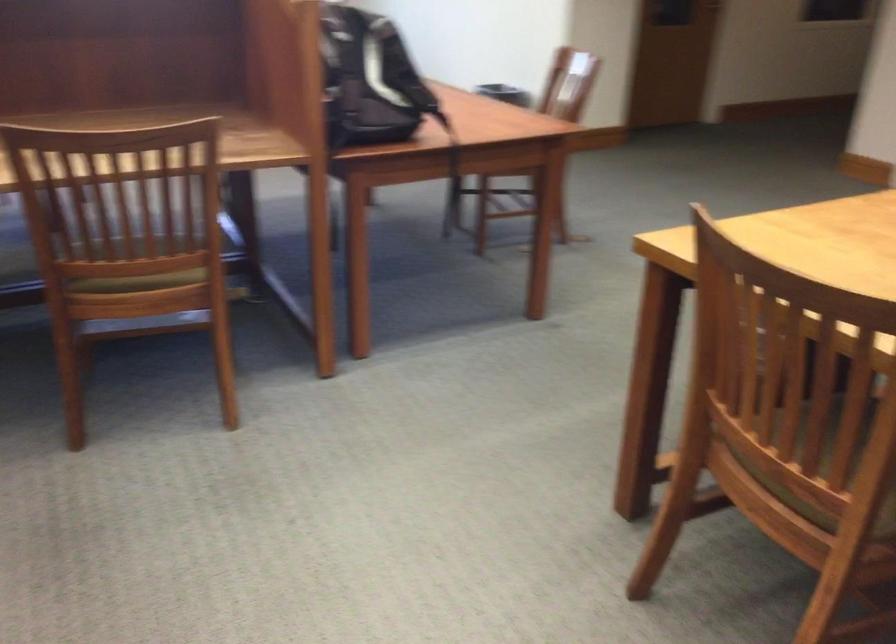
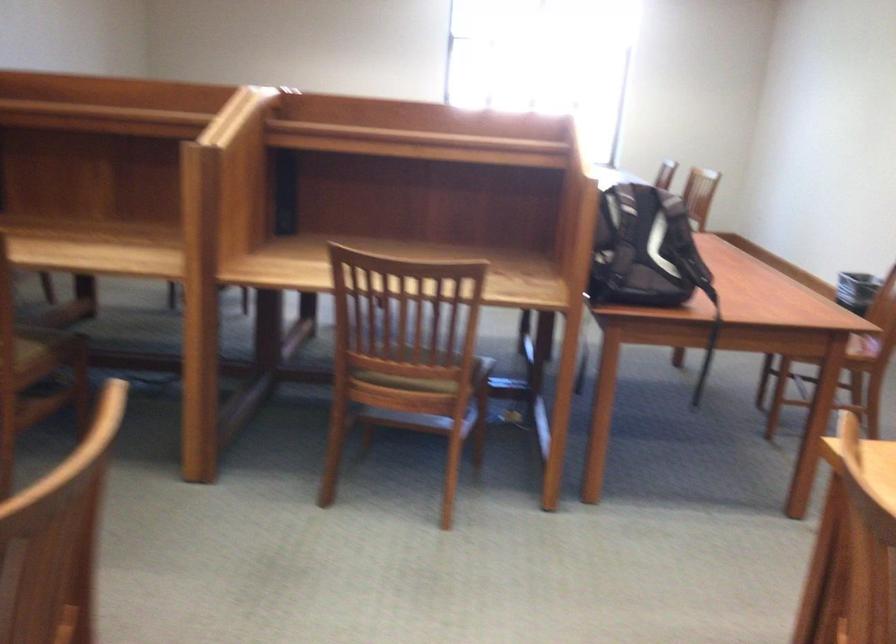
Locate, in the second image, the point that corresponds to pixel 373 88 in the first image.

(644, 250)